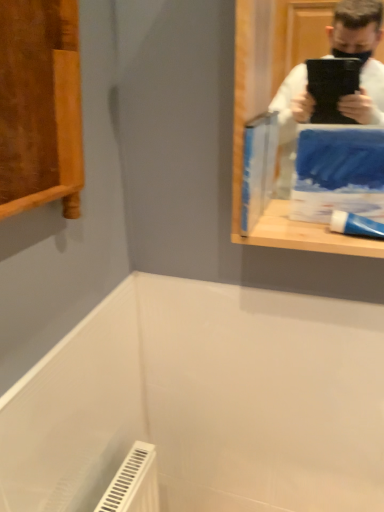
Question: Is blue paper at upper right, positioned as the second paperback book in right-to-left order, completely or partially outside of white glossy toothpaste at right?

Choices:
 (A) no
 (B) yes

Answer: (B)

Question: Is blue paper at upper right, marked as the 1th paperback book in a left-to-right arrangement, directly adjacent to white glossy toothpaste at right?

Choices:
 (A) no
 (B) yes

Answer: (A)

Question: From the image's perspective, is blue paper at upper right, positioned as the second paperback book in right-to-left order, under white glossy toothpaste at right?

Choices:
 (A) yes
 (B) no

Answer: (B)

Question: Does blue paper at upper right, marked as the 1th paperback book in a left-to-right arrangement, lie behind white glossy toothpaste at right?

Choices:
 (A) yes
 (B) no

Answer: (A)

Question: Does blue paper at upper right, marked as the 1th paperback book in a left-to-right arrangement, have a smaller size compared to white glossy toothpaste at right?

Choices:
 (A) no
 (B) yes

Answer: (A)

Question: Based on their sizes in the image, would you say white glossy toothpaste at right is bigger or smaller than blue paper at upper right, positioned as the second paperback book in right-to-left order?

Choices:
 (A) small
 (B) big

Answer: (A)

Question: Considering the positions of white glossy toothpaste at right and blue paper at upper right, positioned as the second paperback book in right-to-left order, in the image, is white glossy toothpaste at right wider or thinner than blue paper at upper right, positioned as the second paperback book in right-to-left order,?

Choices:
 (A) wide
 (B) thin

Answer: (A)

Question: Is white glossy toothpaste at right in front of or behind blue paper at upper right, positioned as the second paperback book in right-to-left order, in the image?

Choices:
 (A) behind
 (B) front

Answer: (B)

Question: From a real-world perspective, is white glossy toothpaste at right above or below blue paper at upper right, marked as the 1th paperback book in a left-to-right arrangement?

Choices:
 (A) below
 (B) above

Answer: (A)

Question: Is blue paper at upper right, marked as the 1th paperback book in a left-to-right arrangement, in front of or behind blue matte paperback book at upper right, the second paperback book viewed from the left, in the image?

Choices:
 (A) front
 (B) behind

Answer: (B)

Question: Is blue paper at upper right, marked as the 1th paperback book in a left-to-right arrangement, situated inside blue matte paperback book at upper right, the second paperback book viewed from the left, or outside?

Choices:
 (A) outside
 (B) inside

Answer: (A)

Question: From the image's perspective, is blue paper at upper right, marked as the 1th paperback book in a left-to-right arrangement, above or below blue matte paperback book at upper right, the 1th paperback book from the right?

Choices:
 (A) above
 (B) below

Answer: (A)

Question: Considering the positions of point (x=271, y=188) and point (x=349, y=206), is point (x=271, y=188) closer or farther from the camera than point (x=349, y=206)?

Choices:
 (A) closer
 (B) farther

Answer: (B)

Question: In terms of width, does white glossy toothpaste at right look wider or thinner when compared to blue matte paperback book at upper right, the 1th paperback book from the right?

Choices:
 (A) wide
 (B) thin

Answer: (A)

Question: Looking at the image, does white glossy toothpaste at right seem bigger or smaller compared to blue matte paperback book at upper right, the second paperback book viewed from the left?

Choices:
 (A) small
 (B) big

Answer: (A)